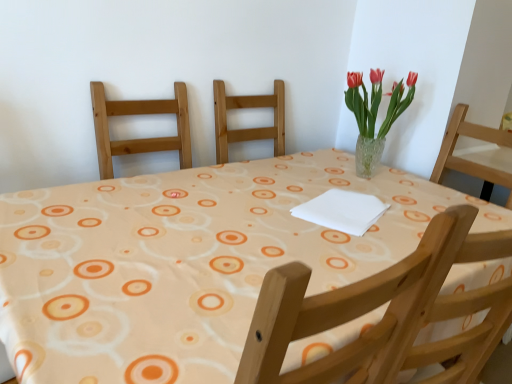
Question: From the image's perspective, is translucent glass vase at upper right located above or below matte orange tablecloth at center?

Choices:
 (A) above
 (B) below

Answer: (A)

Question: Choose the correct answer: Is translucent glass vase at upper right inside matte orange tablecloth at center or outside it?

Choices:
 (A) outside
 (B) inside

Answer: (A)

Question: From a real-world perspective, is translucent glass vase at upper right physically located above or below matte orange tablecloth at center?

Choices:
 (A) below
 (B) above

Answer: (B)

Question: In terms of size, does matte orange tablecloth at center appear bigger or smaller than translucent glass vase at upper right?

Choices:
 (A) small
 (B) big

Answer: (B)

Question: Is matte orange tablecloth at center to the left or to the right of translucent glass vase at upper right in the image?

Choices:
 (A) left
 (B) right

Answer: (A)

Question: From a real-world perspective, is matte orange tablecloth at center above or below translucent glass vase at upper right?

Choices:
 (A) below
 (B) above

Answer: (A)

Question: Relative to translucent glass vase at upper right, is matte orange tablecloth at center in front or behind?

Choices:
 (A) behind
 (B) front

Answer: (B)